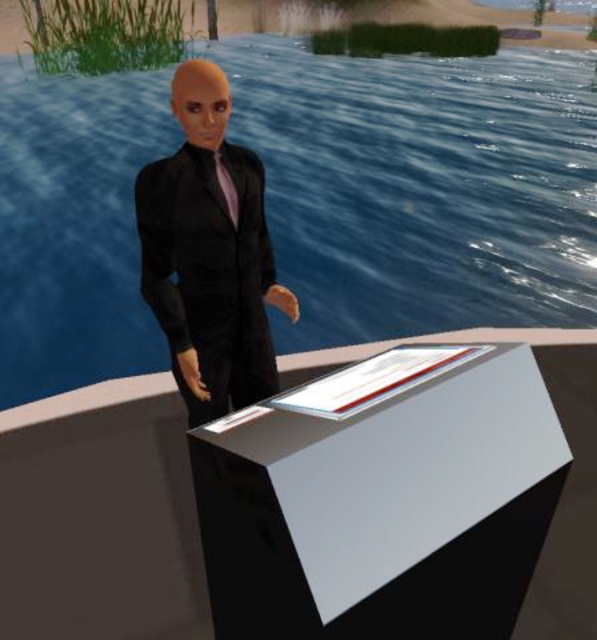
Question: Which object appears closest to the camera in this image?

Choices:
 (A) black satin suit at center
 (B) white glossy table at center
 (C) blue glossy water at center

Answer: (A)

Question: Is white glossy table at center smaller than black satin suit at center?

Choices:
 (A) yes
 (B) no

Answer: (B)

Question: Can you confirm if blue glossy water at center is positioned above black satin suit at center?

Choices:
 (A) yes
 (B) no

Answer: (A)

Question: Considering the real-world distances, which object is farthest from the matte black tie at center?

Choices:
 (A) white glossy table at center
 (B) black satin suit at center
 (C) blue glossy water at center

Answer: (C)

Question: Which object is the closest to the black satin suit at center?

Choices:
 (A) matte black tie at center
 (B) white glossy table at center

Answer: (A)

Question: Does black satin suit at center appear on the right side of matte black tie at center?

Choices:
 (A) yes
 (B) no

Answer: (B)